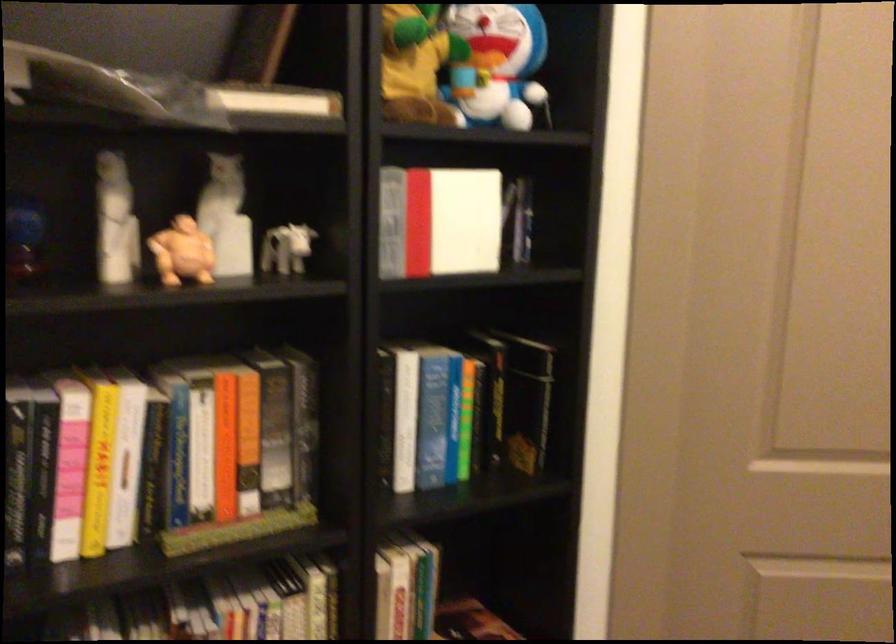
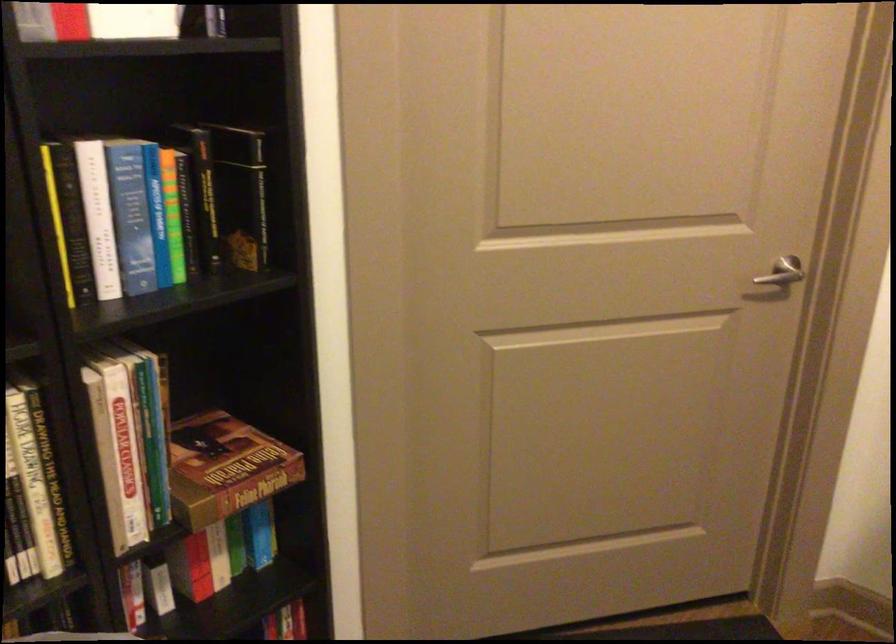
In the second image, find the point that corresponds to pixel 408 413 in the first image.

(98, 216)